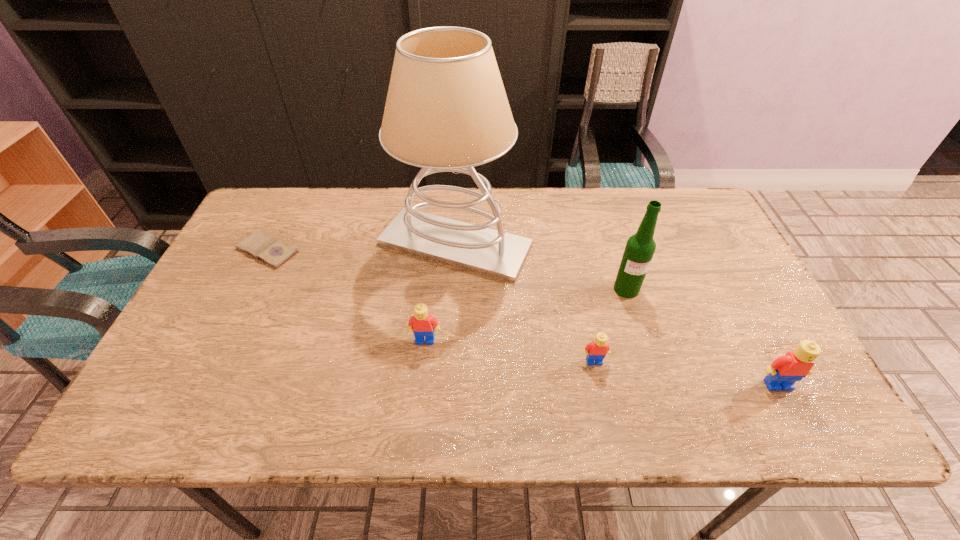
I want to click on the leftmost object, so click(x=265, y=247).

Where is `vacant space located 0.060m on the face of the third nearest object`? vacant space located 0.060m on the face of the third nearest object is located at coordinates (422, 367).

The image size is (960, 540). Identify the location of free space located 0.160m on the label of the second tallest object. (645, 350).

At what (x,y) coordinates should I click in order to perform the action: click on free spot located 0.080m on the front of the tallest object. Please return your answer as a coordinate pair (x, y). This screenshot has width=960, height=540. Looking at the image, I should click on (451, 308).

This screenshot has width=960, height=540. Find the location of `vacant space located 0.110m on the back of the leftmost object`. vacant space located 0.110m on the back of the leftmost object is located at coordinates (287, 211).

Where is `table lamp situated at the far edge`? The width and height of the screenshot is (960, 540). table lamp situated at the far edge is located at coordinates (446, 110).

You are a GUI agent. You are given a task and a screenshot of the screen. Output one action in this format:
    pyautogui.click(x=<x>, y=<y>)
    Task: Click on the diary present at the far edge
    Image resolution: width=960 pixels, height=540 pixels.
    Given the screenshot: What is the action you would take?
    pyautogui.click(x=265, y=247)

Locate an element on the screen. object located in the left edge section of the desktop is located at coordinates (265, 247).

I want to click on object located in the right edge section of the desktop, so click(x=784, y=371).

At what (x,y) coordinates should I click in order to perform the action: click on object that is positioned at the far left corner. Please return your answer as a coordinate pair (x, y). The width and height of the screenshot is (960, 540). Looking at the image, I should click on pos(265,247).